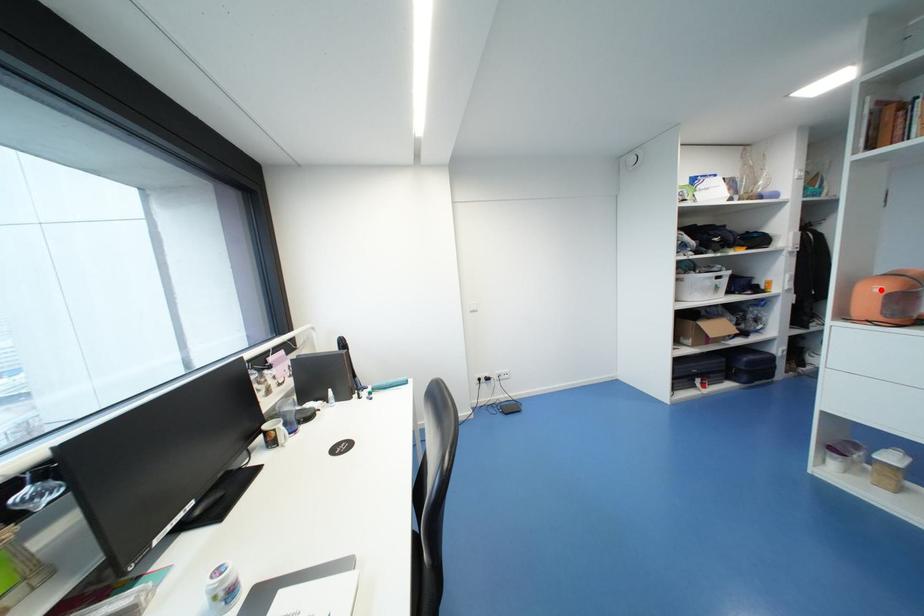
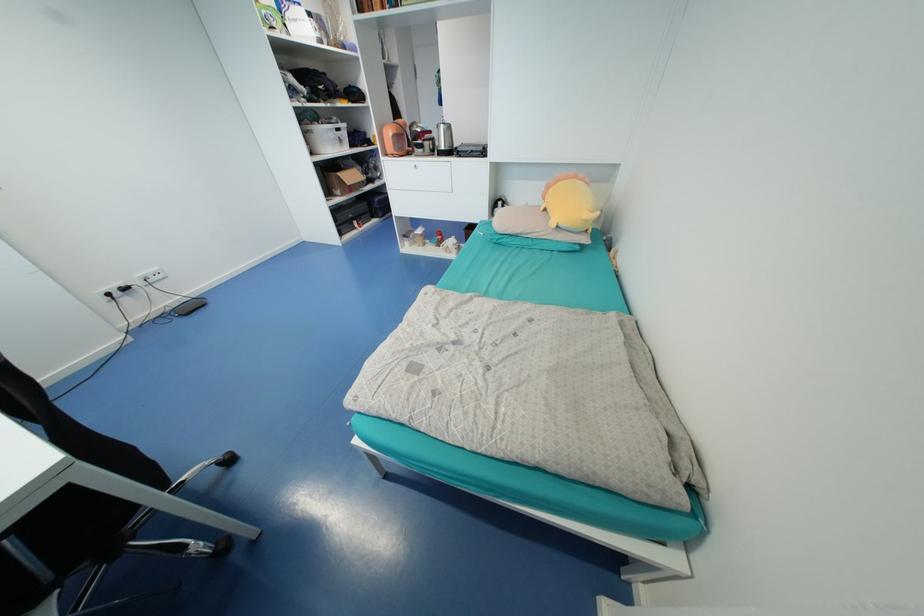
Question: I am providing you with two images of the same scene from different viewpoints. In image1, a red point is highlighted. Considering the same 3D point in image2, which of the following is correct?

Choices:
 (A) It is closer
 (B) It is farther

Answer: (A)